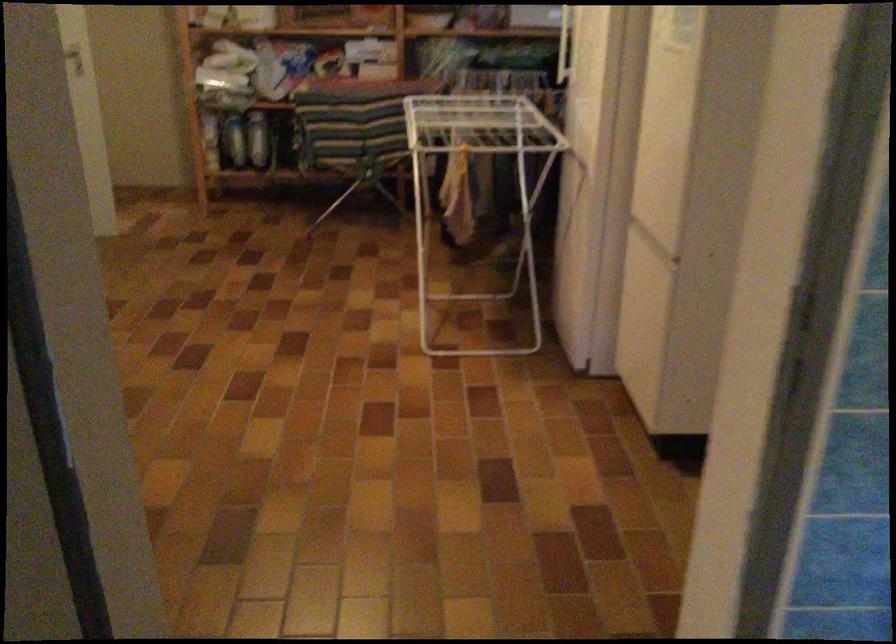
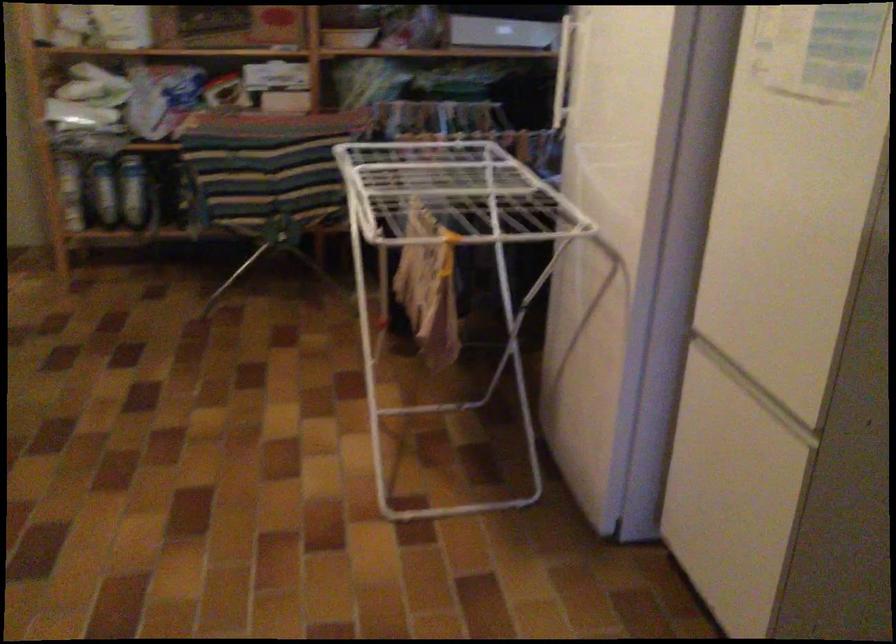
Question: How did the camera likely rotate?

Choices:
 (A) Left
 (B) Right
 (C) Up
 (D) Down

Answer: (B)